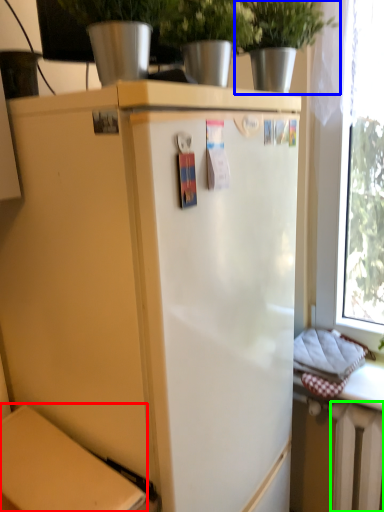
Question: Which object is the farthest from back (highlighted by a red box)? Choose among these: houseplant (highlighted by a blue box) or radiator (highlighted by a green box).

Choices:
 (A) houseplant
 (B) radiator

Answer: (A)